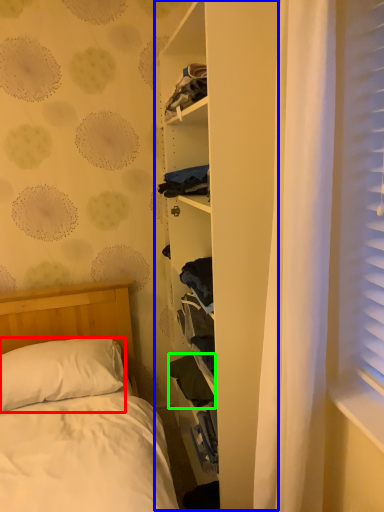
Question: Which is nearer to the pillow (highlighted by a red box)? bookshelf (highlighted by a blue box) or clothing (highlighted by a green box).

Choices:
 (A) bookshelf
 (B) clothing

Answer: (B)